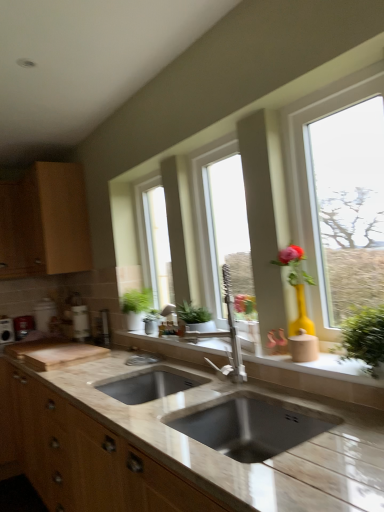
What is the approximate width of yellow matte vase at right, positioned as the third window in back-to-front order?

yellow matte vase at right, positioned as the third window in back-to-front order, is 14.28 centimeters in width.

This screenshot has height=512, width=384. In order to click on metallic silver toaster at left, which is counted as the 1th appliance, starting from the right in this screenshot , I will do `click(23, 326)`.

You are a GUI agent. You are given a task and a screenshot of the screen. Output one action in this format:
    pyautogui.click(x=<x>, y=<y>)
    Task: Click on the brushed metal toaster at lower left, placed as the 1th appliance when sorted from left to right
    Image resolution: width=384 pixels, height=512 pixels.
    Given the screenshot: What is the action you would take?
    pyautogui.click(x=6, y=330)

Describe the element at coordinates (221, 224) in the screenshot. I see `clear glass window at center, which appears as the second window when viewed from the right` at that location.

From the picture: Measure the distance between point [160,188] and camera.

Point [160,188] and camera are 2.80 meters apart.

This screenshot has width=384, height=512. I want to click on yellow matte vase at right, the 1th window when ordered from front to back, so click(317, 177).

Which of these two, wooden cabinet at left or yellow matte vase at right, which is the first window from right to left, is bigger?

wooden cabinet at left is bigger.

Can you confirm if wooden cabinet at left is positioned to the left of yellow matte vase at right, the third window viewed from the left?

Yes, wooden cabinet at left is to the left of yellow matte vase at right, the third window viewed from the left.

From a real-world perspective, which object stands above the other?

wooden cabinet at left.

Is wooden cabinet at left wider or thinner than yellow matte vase at right, which is the first window from right to left?

wooden cabinet at left is wider than yellow matte vase at right, which is the first window from right to left.

Does metallic silver toaster at left, which is counted as the 1th appliance, starting from the right, appear on the right side of yellow matte vase at right, the third window viewed from the left?

No.

From the image's perspective, is metallic silver toaster at left, which ranks as the second appliance in left-to-right order, below yellow matte vase at right, the 1th window when ordered from front to back?

Correct, metallic silver toaster at left, which ranks as the second appliance in left-to-right order, appears lower than yellow matte vase at right, the 1th window when ordered from front to back, in the image.

Can you tell me how much metallic silver toaster at left, which is counted as the 1th appliance, starting from the right, and yellow matte vase at right, the 1th window when ordered from front to back, differ in facing direction?

The angular difference between metallic silver toaster at left, which is counted as the 1th appliance, starting from the right, and yellow matte vase at right, the 1th window when ordered from front to back, is 89.1 degrees.

In terms of size, does metallic silver toaster at left, which is counted as the 1th appliance, starting from the right, appear bigger or smaller than yellow matte vase at right, the third window viewed from the left?

metallic silver toaster at left, which is counted as the 1th appliance, starting from the right, is smaller than yellow matte vase at right, the third window viewed from the left.

Considering the relative sizes of yellow matte vase at right, which is the first window from right to left, and metallic silver toaster at left, which ranks as the second appliance in left-to-right order, in the image provided, is yellow matte vase at right, which is the first window from right to left, smaller than metallic silver toaster at left, which ranks as the second appliance in left-to-right order,?

No, yellow matte vase at right, which is the first window from right to left, is not smaller than metallic silver toaster at left, which ranks as the second appliance in left-to-right order.

Considering the positions of objects yellow matte vase at right, the 1th window when ordered from front to back, and metallic silver toaster at left, which is counted as the 1th appliance, starting from the right, in the image provided, who is more to the left, yellow matte vase at right, the 1th window when ordered from front to back, or metallic silver toaster at left, which is counted as the 1th appliance, starting from the right,?

Positioned to the left is metallic silver toaster at left, which is counted as the 1th appliance, starting from the right.

In terms of height, does yellow matte vase at right, which is the first window from right to left, look taller or shorter compared to metallic silver toaster at left, which ranks as the second appliance in left-to-right order?

Considering their sizes, yellow matte vase at right, which is the first window from right to left, has more height than metallic silver toaster at left, which ranks as the second appliance in left-to-right order.

Between yellow matte vase at right, the 1th window when ordered from front to back, and metallic silver toaster at left, which ranks as the second appliance in left-to-right order, which one is positioned behind?

metallic silver toaster at left, which ranks as the second appliance in left-to-right order, is further from the camera.

Which object is further away from the camera taking this photo, beige stone sink at center or brushed metal toaster at lower left, placed as the 2th appliance when sorted from right to left?

brushed metal toaster at lower left, placed as the 2th appliance when sorted from right to left, is further away from the camera.

Considering the sizes of objects beige stone sink at center and brushed metal toaster at lower left, placed as the 1th appliance when sorted from left to right, in the image provided, who is wider, beige stone sink at center or brushed metal toaster at lower left, placed as the 1th appliance when sorted from left to right,?

With larger width is beige stone sink at center.

Is point (304, 362) closer to viewer compared to point (6, 334)?

Yes, it is in front of point (6, 334).

How distant is green matte plant at center, marked as the 1th houseplant in a back-to-front arrangement, from green matte plant at center, marked as the 3th window in a front-to-back arrangement?

green matte plant at center, marked as the 1th houseplant in a back-to-front arrangement, is 11.45 inches away from green matte plant at center, marked as the 3th window in a front-to-back arrangement.

Is green matte plant at center, arranged as the 1th window when viewed from the back, located within green matte plant at center, which ranks as the 2th houseplant in front-to-back order?

No, green matte plant at center, arranged as the 1th window when viewed from the back, is not surrounded by green matte plant at center, which ranks as the 2th houseplant in front-to-back order.

Is green matte plant at center, which ranks as the 2th houseplant in front-to-back order, oriented towards green matte plant at center, positioned as the third window in right-to-left order?

No.

From their relative heights in the image, would you say green matte plant at center, which ranks as the second houseplant in right-to-left order, is taller or shorter than green matte plant at center, arranged as the 1th window when viewed from the back?

Clearly, green matte plant at center, which ranks as the second houseplant in right-to-left order, is shorter compared to green matte plant at center, arranged as the 1th window when viewed from the back.

Is green matte plant at center, marked as the 1th houseplant in a back-to-front arrangement, positioned with its back to clear glass window at center, which appears as the second window when viewed from the right?

No, clear glass window at center, which appears as the second window when viewed from the right, is not at the back of green matte plant at center, marked as the 1th houseplant in a back-to-front arrangement.

From the image's perspective, which one is positioned lower, green matte plant at center, marked as the 1th houseplant in a back-to-front arrangement, or clear glass window at center, which appears as the second window when viewed from the right?

green matte plant at center, marked as the 1th houseplant in a back-to-front arrangement, appears lower in the image.

Considering the positions of objects green matte plant at center, which ranks as the second houseplant in right-to-left order, and clear glass window at center, which ranks as the second window in left-to-right order, in the image provided, who is in front, green matte plant at center, which ranks as the second houseplant in right-to-left order, or clear glass window at center, which ranks as the second window in left-to-right order,?

clear glass window at center, which ranks as the second window in left-to-right order, is more forward.

Who is more distant, yellow matte vase at right, which is the first window from right to left, or brushed metal toaster at lower left, placed as the 2th appliance when sorted from right to left?

brushed metal toaster at lower left, placed as the 2th appliance when sorted from right to left, is further away from the camera.

Based on the photo, would you say yellow matte vase at right, which is the first window from right to left, contains brushed metal toaster at lower left, placed as the 2th appliance when sorted from right to left?

Actually, brushed metal toaster at lower left, placed as the 2th appliance when sorted from right to left, is outside yellow matte vase at right, which is the first window from right to left.

Considering the sizes of yellow matte vase at right, which is the first window from right to left, and brushed metal toaster at lower left, placed as the 1th appliance when sorted from left to right, in the image, is yellow matte vase at right, which is the first window from right to left, bigger or smaller than brushed metal toaster at lower left, placed as the 1th appliance when sorted from left to right,?

Considering their sizes, yellow matte vase at right, which is the first window from right to left, takes up more space than brushed metal toaster at lower left, placed as the 1th appliance when sorted from left to right.

Is yellow matte vase at right, which is the first window from right to left, oriented away from brushed metal toaster at lower left, placed as the 2th appliance when sorted from right to left?

yellow matte vase at right, which is the first window from right to left, is not turned away from brushed metal toaster at lower left, placed as the 2th appliance when sorted from right to left.

From the image's perspective, which window is the 1st one below the wooden cabinet at left? Please provide its 2D coordinates.

[(317, 177)]

From a real-world perspective, which appliance is the 1st one underneath the yellow matte vase at right, the third window viewed from the left? Please provide its 2D coordinates.

[(23, 326)]

When comparing their distances from clear glass window at center, which ranks as the second window in left-to-right order, does green matte plant at center, marked as the 1th houseplant in a back-to-front arrangement, or yellow matte vase at right, positioned as the third window in back-to-front order, seem further?

The object further to clear glass window at center, which ranks as the second window in left-to-right order, is green matte plant at center, marked as the 1th houseplant in a back-to-front arrangement.

From the image, which object appears to be nearer to green matte plant at center, acting as the 1th houseplant starting from the left, green matte plant at center, arranged as the 1th window when viewed from the back, or metallic silver toaster at left, which is counted as the 1th appliance, starting from the right?

The object closer to green matte plant at center, acting as the 1th houseplant starting from the left, is green matte plant at center, arranged as the 1th window when viewed from the back.

Estimate the real-world distances between objects in this image. Which object is further from brushed metal toaster at lower left, placed as the 1th appliance when sorted from left to right, metallic silver toaster at left, which ranks as the second appliance in left-to-right order, or beige stone sink at center?

beige stone sink at center is positioned further to the anchor brushed metal toaster at lower left, placed as the 1th appliance when sorted from left to right.

From the picture: Which object lies nearer to the anchor point metallic silver toaster at left, which is counted as the 1th appliance, starting from the right, clear glass window at center, marked as the 2th window in a back-to-front arrangement, or beige stone sink at center?

beige stone sink at center lies closer to metallic silver toaster at left, which is counted as the 1th appliance, starting from the right, than the other object.

Considering their positions, is clear glass window at center, marked as the 2th window in a back-to-front arrangement, positioned closer to yellow matte vase at right, which is the first window from right to left, than wooden cabinet at left?

clear glass window at center, marked as the 2th window in a back-to-front arrangement, lies closer to yellow matte vase at right, which is the first window from right to left, than the other object.

Considering their positions, is green matte plant at center, marked as the 3th window in a front-to-back arrangement, positioned further to wooden cabinet at left than brushed metal toaster at lower left, placed as the 1th appliance when sorted from left to right?

Based on the image, green matte plant at center, marked as the 3th window in a front-to-back arrangement, appears to be further to wooden cabinet at left.

From the image, which object appears to be nearer to metallic silver toaster at left, which ranks as the second appliance in left-to-right order, beige stone sink at center or green matte plant at center, marked as the 1th houseplant in a back-to-front arrangement?

Among the two, green matte plant at center, marked as the 1th houseplant in a back-to-front arrangement, is located nearer to metallic silver toaster at left, which ranks as the second appliance in left-to-right order.

In the scene shown: Based on their spatial positions, is metallic silver toaster at left, which is counted as the 1th appliance, starting from the right, or clear glass window at center, marked as the 2th window in a back-to-front arrangement, closer to green matte plant at center, marked as the 1th houseplant in a back-to-front arrangement?

clear glass window at center, marked as the 2th window in a back-to-front arrangement.

Find the location of a particular element. This screenshot has width=384, height=512. houseplant located between clear glass window at center, marked as the 2th window in a back-to-front arrangement, and metallic silver toaster at left, which ranks as the second appliance in left-to-right order, in the depth direction is located at coordinates (136, 307).

Locate an element on the screen. Image resolution: width=384 pixels, height=512 pixels. window sill between wooden cabinet at left and yellow matte vase at right, positioned as the third window in back-to-front order, in the horizontal direction is located at coordinates (319, 377).

This screenshot has width=384, height=512. In order to click on window between clear glass window at center, marked as the 2th window in a back-to-front arrangement, and green matte plant at center, which ranks as the 2th houseplant in front-to-back order, from front to back in this screenshot , I will do `click(154, 240)`.

Find the location of `appliance between green leafy plant at right, positioned as the 2th houseplant in left-to-right order, and metallic silver toaster at left, which ranks as the second appliance in left-to-right order, along the z-axis`. appliance between green leafy plant at right, positioned as the 2th houseplant in left-to-right order, and metallic silver toaster at left, which ranks as the second appliance in left-to-right order, along the z-axis is located at coordinates (6, 330).